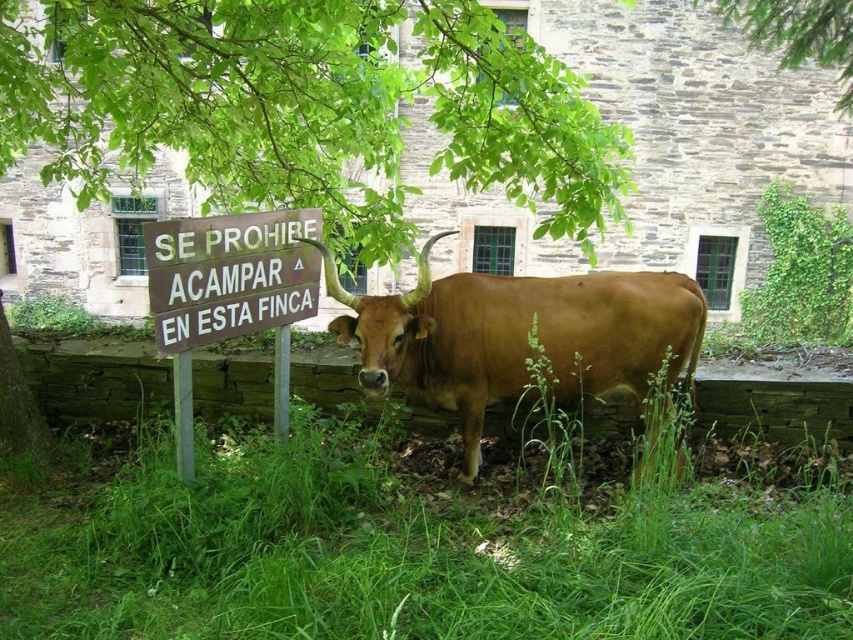
Question: Is the position of green leafy tree at upper center more distant than that of brown wooden sign at center?

Choices:
 (A) yes
 (B) no

Answer: (A)

Question: Does green grass at center have a smaller size compared to brown wooden sign at center?

Choices:
 (A) no
 (B) yes

Answer: (A)

Question: Which object is farther from the camera taking this photo?

Choices:
 (A) brown glossy bull at center
 (B) green leafy tree at upper center
 (C) green grass at center

Answer: (B)

Question: Which of the following is the closest to the observer?

Choices:
 (A) (113, 42)
 (B) (373, 563)
 (C) (677, 317)

Answer: (B)

Question: Can you confirm if brown glossy bull at center is positioned to the left of brown wooden sign at center?

Choices:
 (A) yes
 (B) no

Answer: (B)

Question: Which point is farther from the camera taking this photo?

Choices:
 (A) (683, 330)
 (B) (524, 529)
 (C) (627, 189)
 (D) (184, 333)

Answer: (C)